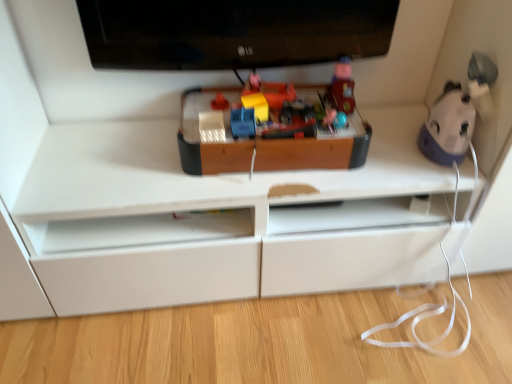
Question: Does wooden toy at center, placed as the fourth toy when sorted from left to right, have a greater height compared to matte blue plastic toy car at center, the fifth toy from the right?

Choices:
 (A) no
 (B) yes

Answer: (B)

Question: Considering the relative sizes of wooden toy at center, placed as the fourth toy when sorted from left to right, and matte blue plastic toy car at center, arranged as the 2th toy when viewed from the left, in the image provided, is wooden toy at center, placed as the fourth toy when sorted from left to right, thinner than matte blue plastic toy car at center, arranged as the 2th toy when viewed from the left,?

Choices:
 (A) yes
 (B) no

Answer: (B)

Question: Is wooden toy at center, placed as the fourth toy when sorted from left to right, oriented away from matte blue plastic toy car at center, the fifth toy from the right?

Choices:
 (A) no
 (B) yes

Answer: (A)

Question: Does wooden toy at center, placed as the fourth toy when sorted from left to right, have a larger size compared to matte blue plastic toy car at center, arranged as the 2th toy when viewed from the left?

Choices:
 (A) yes
 (B) no

Answer: (A)

Question: From the image's perspective, is wooden toy at center, the 3th toy positioned from the right, on matte blue plastic toy car at center, the fifth toy from the right?

Choices:
 (A) no
 (B) yes

Answer: (B)

Question: From a real-world perspective, is wooden toy at center, the 3th toy positioned from the right, physically below matte blue plastic toy car at center, arranged as the 2th toy when viewed from the left?

Choices:
 (A) yes
 (B) no

Answer: (A)

Question: Is matte plastic toy at upper center, the 5th toy viewed from the left, not within matte plastic toy at center, which ranks as the sixth toy in right-to-left order?

Choices:
 (A) yes
 (B) no

Answer: (A)

Question: Is matte plastic toy at upper center, which appears as the 2th toy when viewed from the right, further to the viewer compared to matte plastic toy at center, which ranks as the sixth toy in right-to-left order?

Choices:
 (A) no
 (B) yes

Answer: (A)

Question: Can you confirm if matte plastic toy at upper center, which appears as the 2th toy when viewed from the right, is bigger than matte plastic toy at center, which appears as the first toy when viewed from the left?

Choices:
 (A) yes
 (B) no

Answer: (A)

Question: Is matte plastic toy at upper center, which appears as the 2th toy when viewed from the right, at the right side of matte plastic toy at center, which appears as the first toy when viewed from the left?

Choices:
 (A) yes
 (B) no

Answer: (A)

Question: From a real-world perspective, is matte plastic toy at upper center, the 5th toy viewed from the left, physically above matte plastic toy at center, which ranks as the sixth toy in right-to-left order?

Choices:
 (A) yes
 (B) no

Answer: (A)

Question: Is matte plastic toy at upper center, the 5th toy viewed from the left, looking in the opposite direction of matte plastic toy at center, which appears as the first toy when viewed from the left?

Choices:
 (A) no
 (B) yes

Answer: (A)

Question: Can you confirm if black glossy television at upper center is thinner than matte plastic toy at upper center, the 5th toy viewed from the left?

Choices:
 (A) no
 (B) yes

Answer: (B)